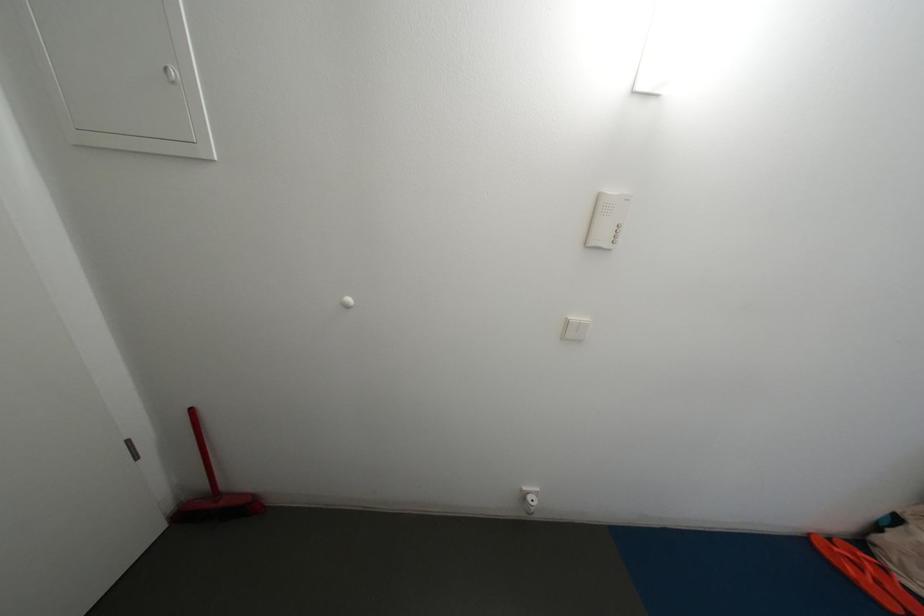
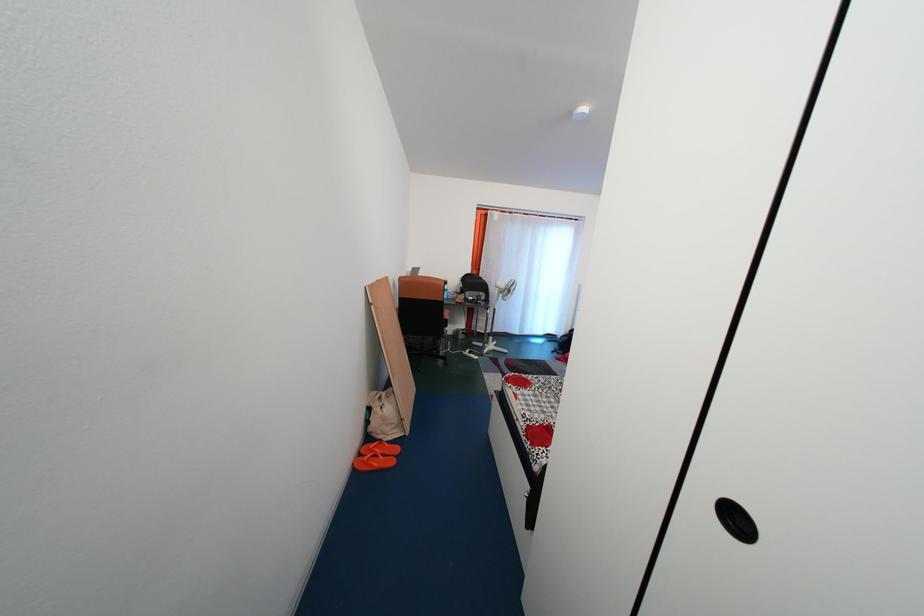
How did the camera likely rotate?

The rotation direction of the camera is right-down.